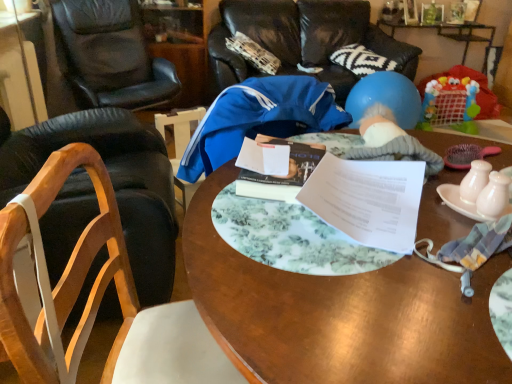
The height and width of the screenshot is (384, 512). What are the coordinates of `free space above wooden table at center (from a real-world perspective)` in the screenshot? It's located at (387, 231).